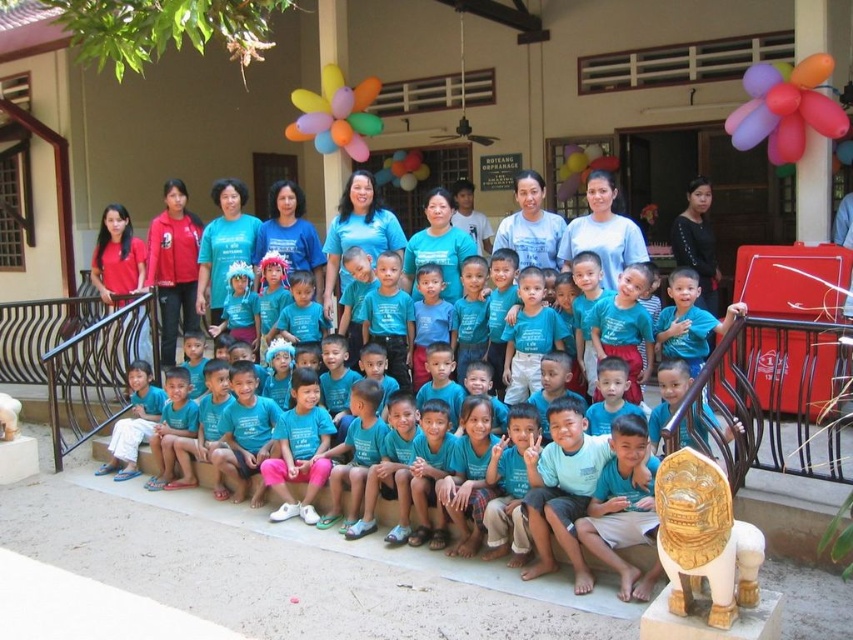
Question: Which point is farther from the camera taking this photo?

Choices:
 (A) (788, 109)
 (B) (405, 172)

Answer: (B)

Question: Does multicolored balloons at center have a smaller size compared to translucent multicolored balloons at center?

Choices:
 (A) no
 (B) yes

Answer: (A)

Question: Estimate the real-world distances between objects in this image. Which object is closer to the multicolored balloons at center?

Choices:
 (A) multicolored glossy balloon at upper right
 (B) translucent multicolored balloons at center

Answer: (B)

Question: From the image, what is the correct spatial relationship of multicolored glossy balloon at upper right in relation to multicolored balloons at center?

Choices:
 (A) right
 (B) left

Answer: (A)

Question: Is multicolored glossy balloon at upper right wider than translucent multicolored balloons at center?

Choices:
 (A) no
 (B) yes

Answer: (A)

Question: Which point appears closest to the camera in this image?

Choices:
 (A) (424, 166)
 (B) (306, 124)

Answer: (B)